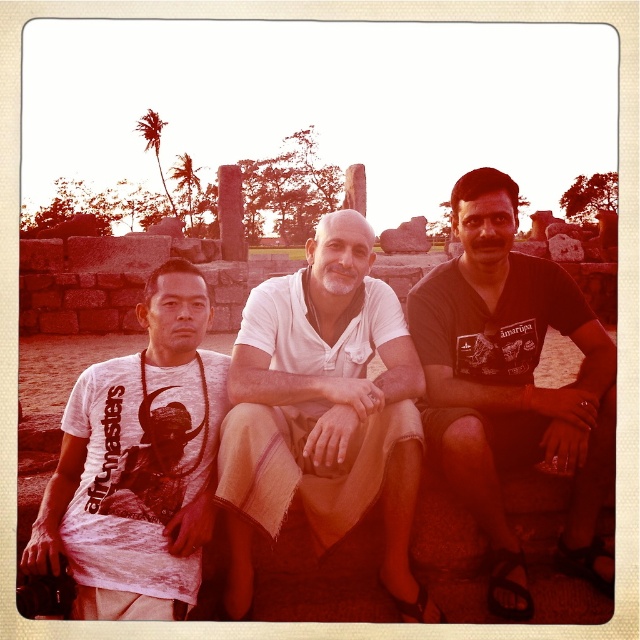
Identify the location of dark brown cotton t-shirt at center. The width and height of the screenshot is (640, 640). (512, 385).

Who is taller, dark brown cotton t-shirt at center or white cotton t-shirt at left?

Standing taller between the two is dark brown cotton t-shirt at center.

Between point (477, 182) and point (198, 376), which one is positioned behind?

Point (477, 182)

The height and width of the screenshot is (640, 640). In order to click on dark brown cotton t-shirt at center in this screenshot , I will do `click(512, 385)`.

Is point (332, 355) positioned in front of point (184, 376)?

That is False.

The image size is (640, 640). I want to click on white cotton shirt at center, so click(323, 412).

Is point (314, 289) in front of point (177, 608)?

No, it is behind (177, 608).

Where is `white cotton shirt at center`? The image size is (640, 640). white cotton shirt at center is located at coordinates (323, 412).

Does white cotton shirt at center have a greater height compared to dark brown cotton t-shirt at center?

No.

Locate an element on the screen. white cotton shirt at center is located at coordinates (323, 412).

Which is in front, point (234, 404) or point (531, 342)?

Point (234, 404) is more forward.

The image size is (640, 640). Find the location of `white cotton shirt at center`. white cotton shirt at center is located at coordinates (323, 412).